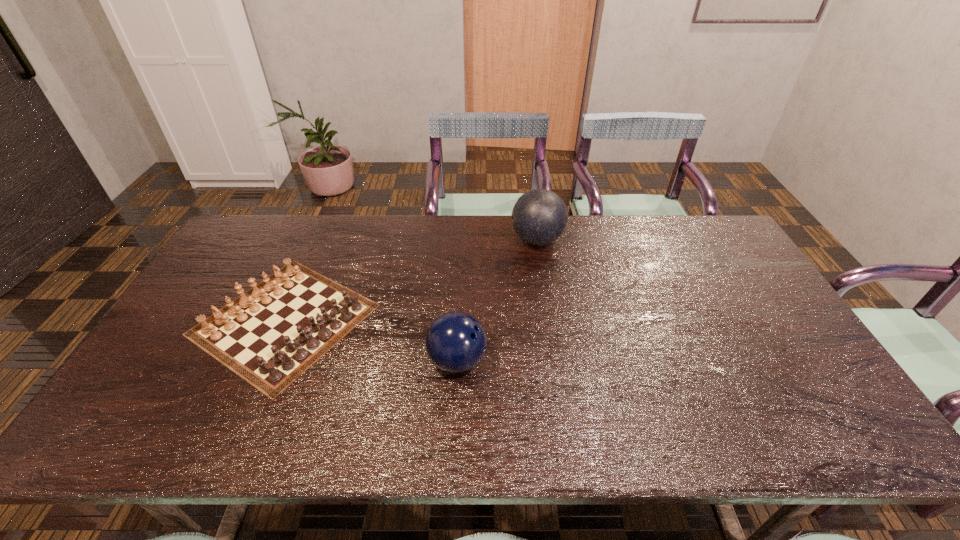
At what (x,y) coordinates should I click in order to perform the action: click on the rightmost object. Please return your answer as a coordinate pair (x, y). The width and height of the screenshot is (960, 540). Looking at the image, I should click on (539, 217).

In order to click on the tallest object in this screenshot , I will do [539, 217].

Image resolution: width=960 pixels, height=540 pixels. Find the location of `the second tallest object`. the second tallest object is located at coordinates (455, 342).

Where is `the second object from left to right`? the second object from left to right is located at coordinates (455, 342).

This screenshot has width=960, height=540. I want to click on the leftmost object, so click(269, 338).

At what (x,y) coordinates should I click in order to perform the action: click on the shortest object. Please return your answer as a coordinate pair (x, y). The image size is (960, 540). Looking at the image, I should click on (269, 338).

You are a GUI agent. You are given a task and a screenshot of the screen. Output one action in this format:
    pyautogui.click(x=<x>, y=<y>)
    Task: Click on the vacant point located 0.080m on the grip area of the taller bowling ball
    The height and width of the screenshot is (540, 960).
    Given the screenshot: What is the action you would take?
    (487, 240)

In order to click on vacant space positioned on the grip area of the taller bowling ball in this screenshot , I will do `click(461, 240)`.

Image resolution: width=960 pixels, height=540 pixels. Find the location of `vacant space positioned 0.250m on the grip area of the taller bowling ball`. vacant space positioned 0.250m on the grip area of the taller bowling ball is located at coordinates (438, 240).

Locate an element on the screen. free space located 0.240m on the surface of the nearer bowling ball near the finger holes is located at coordinates (579, 361).